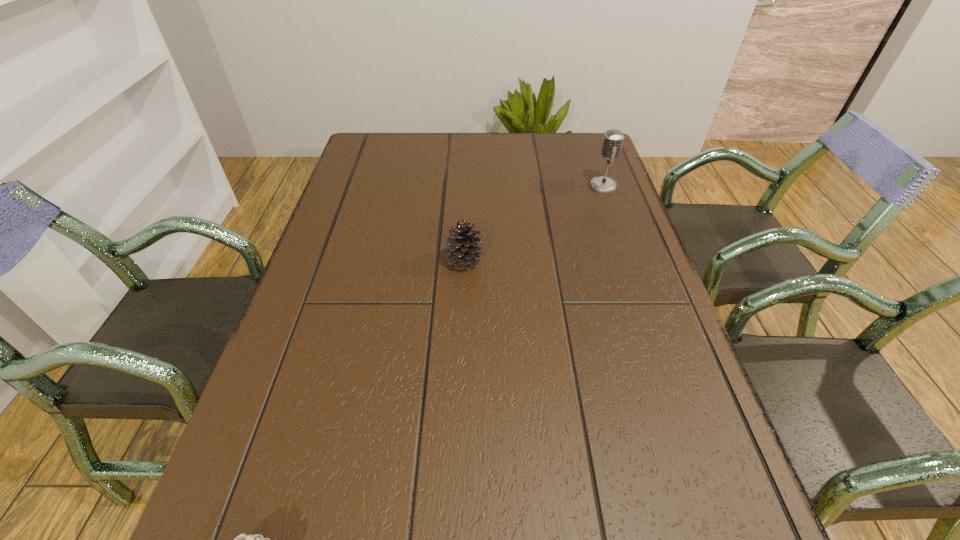
This screenshot has height=540, width=960. In the image, there is a desktop. In order to click on vacant area at the far right corner in this screenshot , I will do `click(566, 158)`.

What are the coordinates of `free spot between the farther pinecone and the rightmost object` in the screenshot? It's located at (534, 224).

At what (x,y) coordinates should I click in order to perform the action: click on object that is the second closest to the farthest object. Please return your answer as a coordinate pair (x, y). This screenshot has height=540, width=960. Looking at the image, I should click on (243, 539).

Identify which object is the second closest to the right pinecone. Please provide its 2D coordinates. Your answer should be formatted as a tuple, i.e. [(x, y)], where the tuple contains the x and y coordinates of a point satisfying the conditions above.

[(243, 539)]

You are a GUI agent. You are given a task and a screenshot of the screen. Output one action in this format:
    pyautogui.click(x=<x>, y=<y>)
    Task: Click on the vacant region that satisfies the following two spatial constraints: 1. on the back side of the microphone; 2. on the right side of the right pinecone
    
    Given the screenshot: What is the action you would take?
    pyautogui.click(x=467, y=186)

Image resolution: width=960 pixels, height=540 pixels. What are the coordinates of `free space that satisfies the following two spatial constraints: 1. on the back side of the microphone; 2. on the left side of the second object from right to left` in the screenshot? It's located at (467, 186).

The height and width of the screenshot is (540, 960). Identify the location of vacant space that satisfies the following two spatial constraints: 1. on the back side of the second tallest object; 2. on the left side of the farthest object. (467, 186).